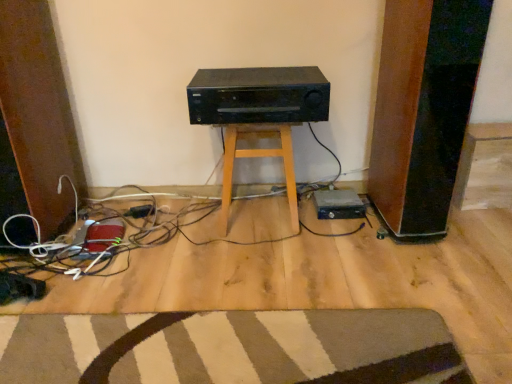
Image resolution: width=512 pixels, height=384 pixels. Find the location of `vacant space underneath black plastic hard drive at lower right (from a real-world perspective)`. vacant space underneath black plastic hard drive at lower right (from a real-world perspective) is located at coordinates (336, 211).